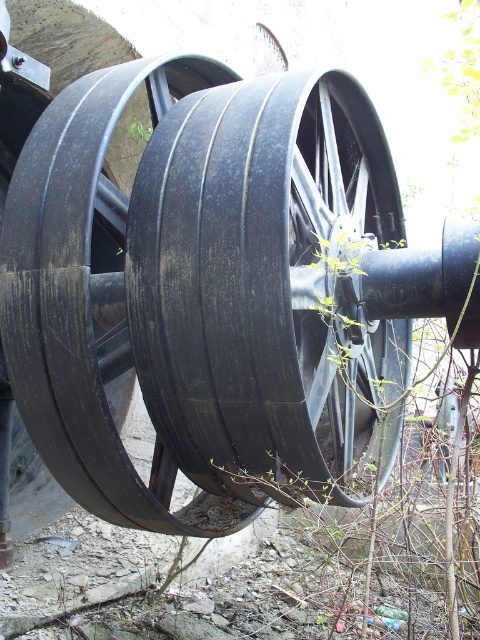
Question: Can you confirm if black rubber wheel at center is positioned to the right of black rubber tire at center?

Choices:
 (A) no
 (B) yes

Answer: (B)

Question: Does black rubber wheel at center appear over black rubber tire at center?

Choices:
 (A) yes
 (B) no

Answer: (B)

Question: Does black rubber wheel at center have a lesser width compared to black rubber tire at center?

Choices:
 (A) no
 (B) yes

Answer: (B)

Question: Which object appears closest to the camera in this image?

Choices:
 (A) black rubber wheel at center
 (B) black rubber tire at center

Answer: (B)

Question: Among these points, which one is nearest to the camera?

Choices:
 (A) (108, 285)
 (B) (230, 467)

Answer: (B)